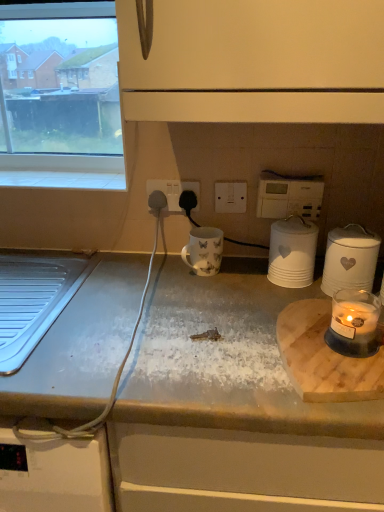
The width and height of the screenshot is (384, 512). In order to click on vacant area that lies between white ceramic jar at right, which ranks as the first kitchen appliance in right-to-left order, and white glossy mug at center in this screenshot , I will do `click(255, 284)`.